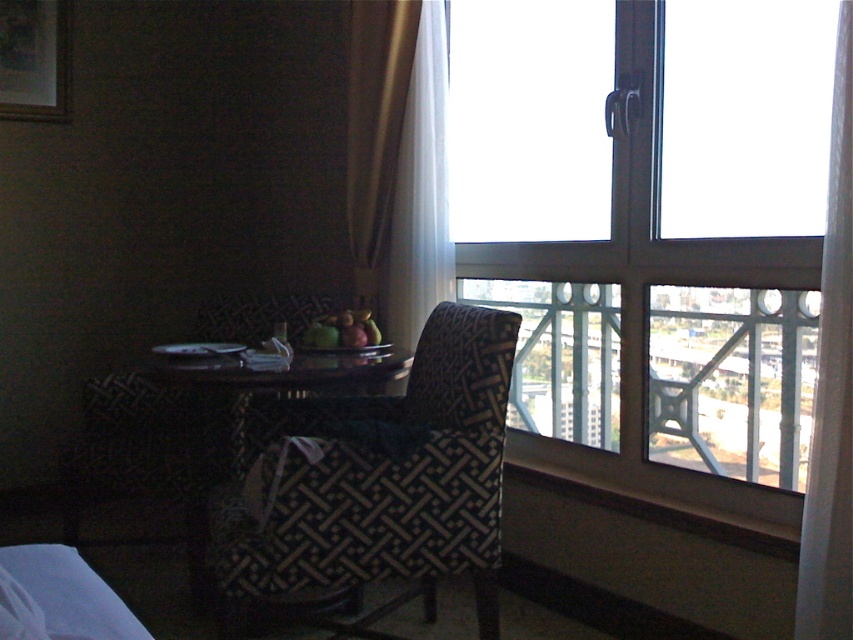
Question: Which point appears closest to the camera in this image?

Choices:
 (A) (439, 209)
 (B) (367, 240)
 (C) (850, 540)
 (D) (590, 474)

Answer: (C)

Question: Observing the image, what is the correct spatial positioning of white sheer curtain at right in reference to black glossy table at center?

Choices:
 (A) above
 (B) below

Answer: (A)

Question: Which object appears closest to the camera in this image?

Choices:
 (A) transparent glass window at upper right
 (B) black glossy table at center

Answer: (A)

Question: Is patterned fabric armchair at center to the right of black glossy table at center from the viewer's perspective?

Choices:
 (A) yes
 (B) no

Answer: (A)

Question: Which of these objects is positioned closest to the gold fabric curtain at upper center?

Choices:
 (A) white sheer curtain at upper right
 (B) black glossy table at center

Answer: (A)

Question: Can you confirm if white sheer curtain at upper right is positioned to the left of black glossy table at center?

Choices:
 (A) yes
 (B) no

Answer: (B)